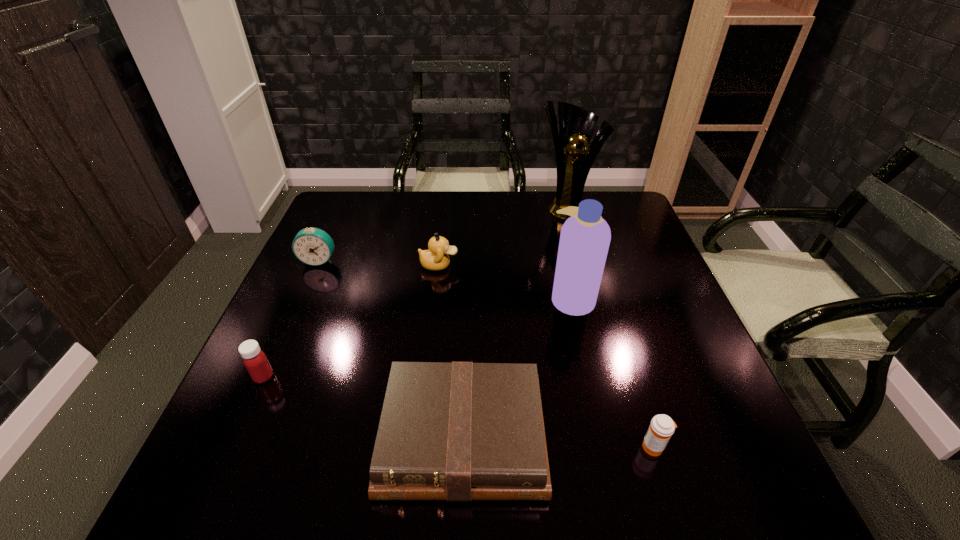
Find the location of a particular element. Image resolution: width=960 pixels, height=540 pixels. vacant space situated on the front-facing side of the alarm clock is located at coordinates (280, 349).

Where is `vacant space located 0.180m on the face of the duckling`? The height and width of the screenshot is (540, 960). vacant space located 0.180m on the face of the duckling is located at coordinates (x=524, y=265).

Where is `vacant space located 0.250m on the right of the farther medicine`? The height and width of the screenshot is (540, 960). vacant space located 0.250m on the right of the farther medicine is located at coordinates (394, 377).

At what (x,y) coordinates should I click in order to perform the action: click on vacant position located on the left of the nearer medicine. Please return your answer as a coordinate pair (x, y). The height and width of the screenshot is (540, 960). Looking at the image, I should click on (538, 447).

Locate an element on the screen. Image resolution: width=960 pixels, height=540 pixels. object situated at the far edge is located at coordinates click(576, 125).

In order to click on medicine positioned at the near edge in this screenshot , I will do tap(662, 427).

Find the location of a particular element. Image resolution: width=960 pixels, height=540 pixels. Bible at the near edge is located at coordinates (458, 431).

Identify the location of alarm clock situated at the left edge. (313, 246).

At what (x,y) coordinates should I click in order to perform the action: click on medicine located at the left edge. Please return your answer as a coordinate pair (x, y). The image size is (960, 540). Looking at the image, I should click on (254, 359).

Find the location of `award present at the right edge`. award present at the right edge is located at coordinates (576, 125).